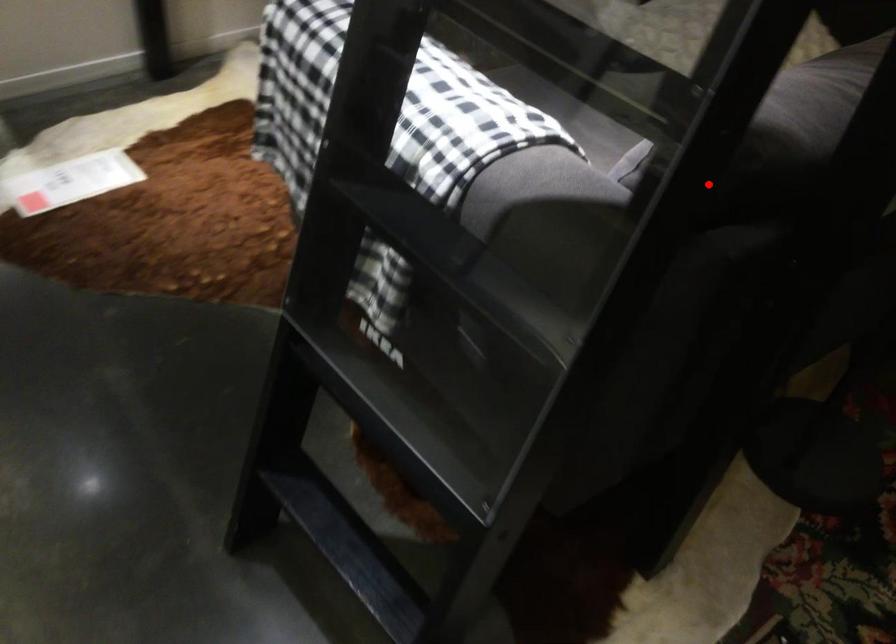
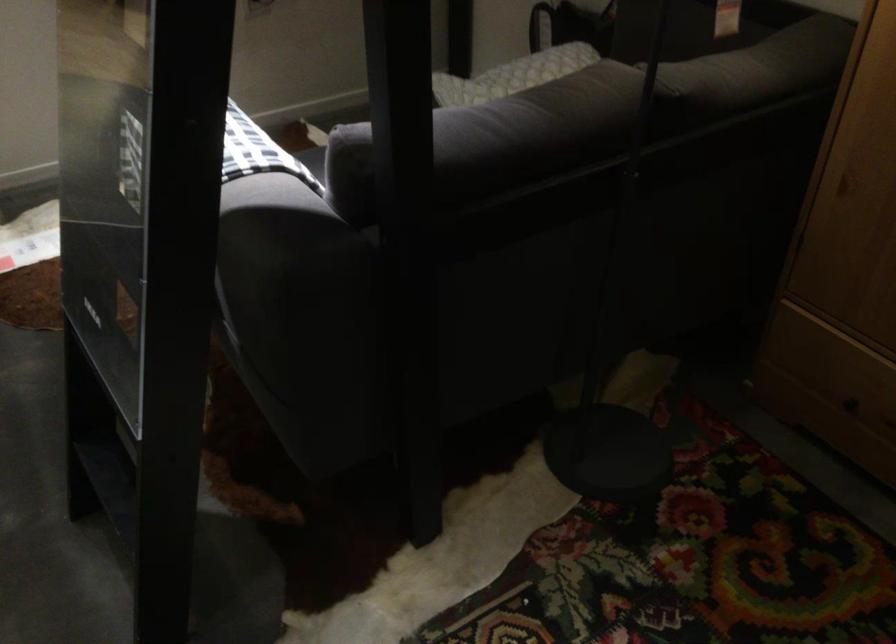
Question: A red point is marked in image1. In image2, is the corresponding 3D point closer to the camera or farther? Reply with the corresponding letter.

Choices:
 (A) The corresponding 3D point is closer.
 (B) The corresponding 3D point is farther.

Answer: (B)